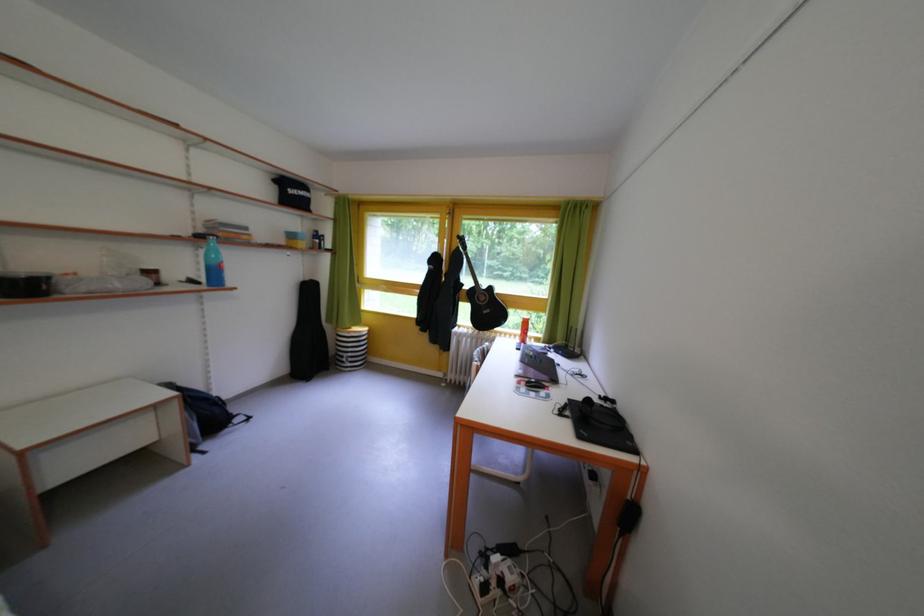
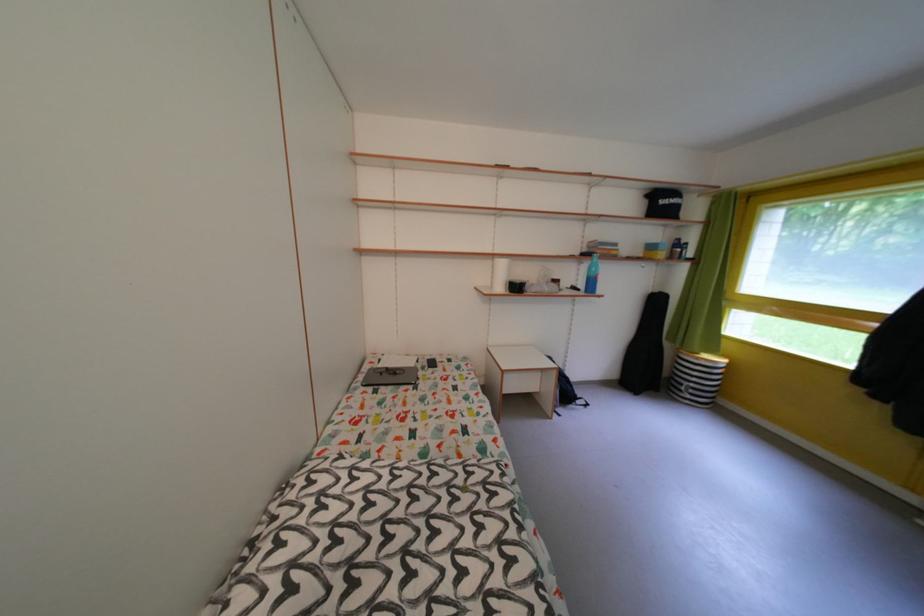
Find the pixel in the second image that matches (212,236) in the first image.

(594, 256)